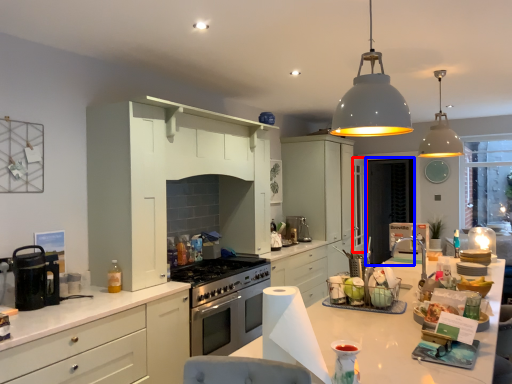
Question: Which point is closer to the camera, glass door (highlighted by a red box) or screen door (highlighted by a blue box)?

Choices:
 (A) glass door
 (B) screen door

Answer: (A)